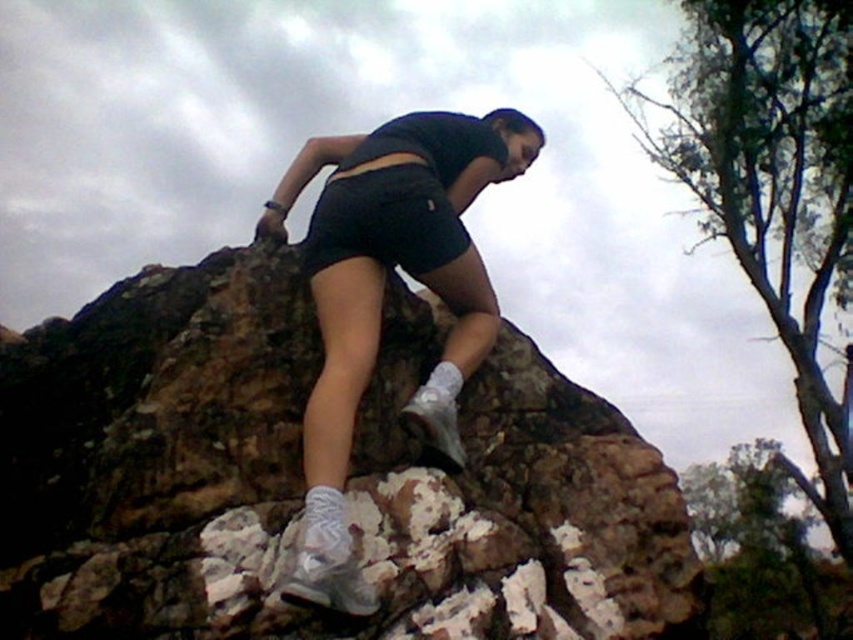
You are a hiker trying to reach the top of the hill. You notice the brown rough rock at center and the black matte shorts at center. Which object is closer to your current position?

The brown rough rock at center is 21.41 inches away from the black matte shorts at center. Since the question asks which is closer to your current position, we need to know the distance from you to each object. However, the given information only states the distance between the two objects. Without knowing your exact location relative to both, we cannot determine which is closer. Please provide more details about your position.

You are a hiker trying to reach the summit. You see the brown rough rock at center. Can you estimate its location in terms of coordinates?

The brown rough rock at center is located at coordinates point (300, 481).

Based on the photo, you are a hiker trying to place your white matte sneakers at center on a stable surface. Given the brown rough rock at center is to the left of your sneakers, which object should you use for better footing?

The brown rough rock at center is to the left of white matte sneakers at center, so you should use the brown rough rock at center for better footing as it provides a stable surface to the left of your current position.